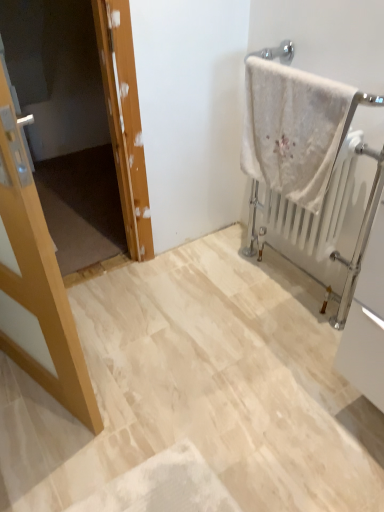
Where is `vacant space that is to the left of white metallic radiator at right`? vacant space that is to the left of white metallic radiator at right is located at coordinates (210, 293).